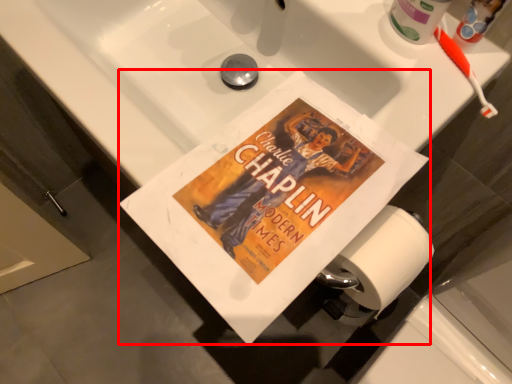
Question: Considering the relative positions of paperback book (annotated by the red box) and toothbrush in the image provided, where is paperback book (annotated by the red box) located with respect to the staircase?

Choices:
 (A) right
 (B) left

Answer: (B)